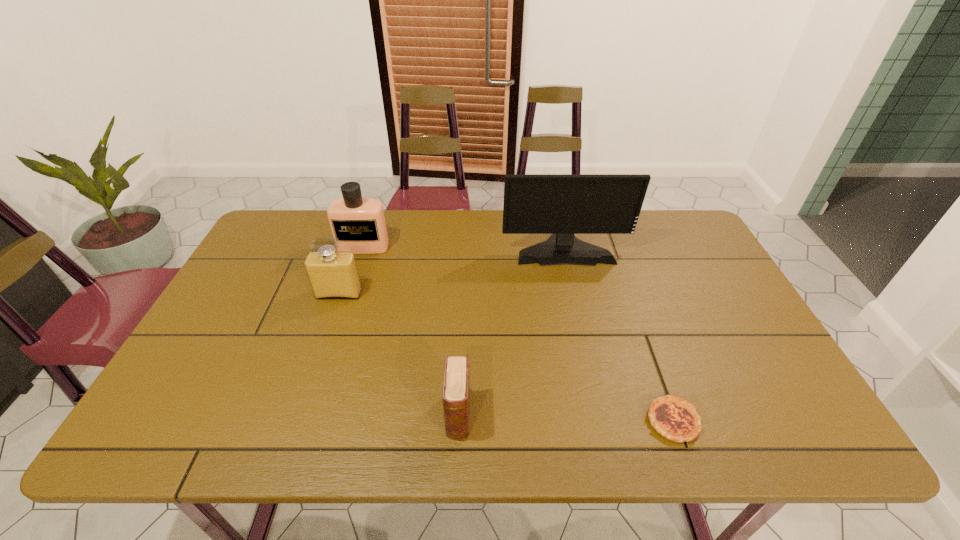
The width and height of the screenshot is (960, 540). In order to click on vacant area situated on the left of the quiche in this screenshot , I will do `click(579, 421)`.

You are a GUI agent. You are given a task and a screenshot of the screen. Output one action in this format:
    pyautogui.click(x=<x>, y=<y>)
    Task: Click on the monitor that is positioned at the far edge
    
    Given the screenshot: What is the action you would take?
    pyautogui.click(x=562, y=205)

Where is `perfume at the far edge`? perfume at the far edge is located at coordinates [x=359, y=223].

This screenshot has height=540, width=960. I want to click on diary situated at the near edge, so click(x=456, y=386).

You are a GUI agent. You are given a task and a screenshot of the screen. Output one action in this format:
    pyautogui.click(x=<x>, y=<y>)
    Task: Click on the quiche situated at the near edge
    
    Given the screenshot: What is the action you would take?
    pyautogui.click(x=674, y=418)

Where is `free region at the far edge of the desktop`? Image resolution: width=960 pixels, height=540 pixels. free region at the far edge of the desktop is located at coordinates (393, 235).

This screenshot has height=540, width=960. In order to click on vacant area at the near edge of the desktop in this screenshot , I will do `click(568, 412)`.

Find the location of a particular element. The width and height of the screenshot is (960, 540). vacant region at the left edge of the desktop is located at coordinates (205, 402).

Identify the location of free space at the right edge. The width and height of the screenshot is (960, 540). (704, 326).

Find the location of a particular element. vacant area at the far right corner of the desktop is located at coordinates (660, 232).